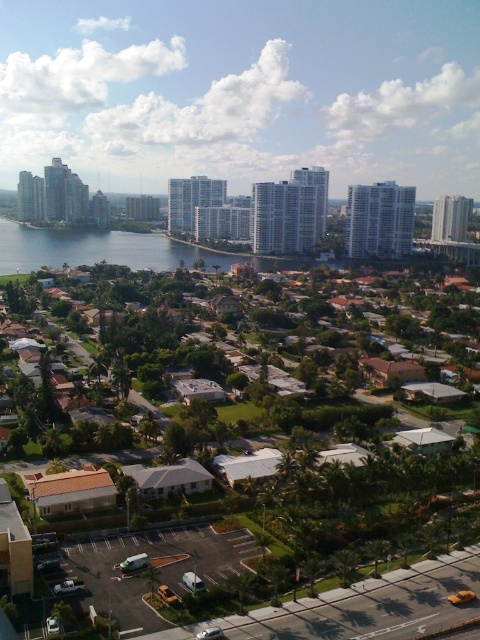
Question: Which point is closer to the camera taking this photo?

Choices:
 (A) (88, 244)
 (B) (247, 602)

Answer: (B)

Question: Is green grass at center to the right of blue water at center from the viewer's perspective?

Choices:
 (A) no
 (B) yes

Answer: (B)

Question: Can you confirm if green grass at center is positioned to the right of blue water at center?

Choices:
 (A) yes
 (B) no

Answer: (A)

Question: Which object appears farthest from the camera in this image?

Choices:
 (A) blue water at center
 (B) green grass at center

Answer: (A)

Question: Does green grass at center have a lesser width compared to blue water at center?

Choices:
 (A) no
 (B) yes

Answer: (B)

Question: Which of the following is the farthest from the observer?

Choices:
 (A) green grass at center
 (B) blue water at center

Answer: (B)